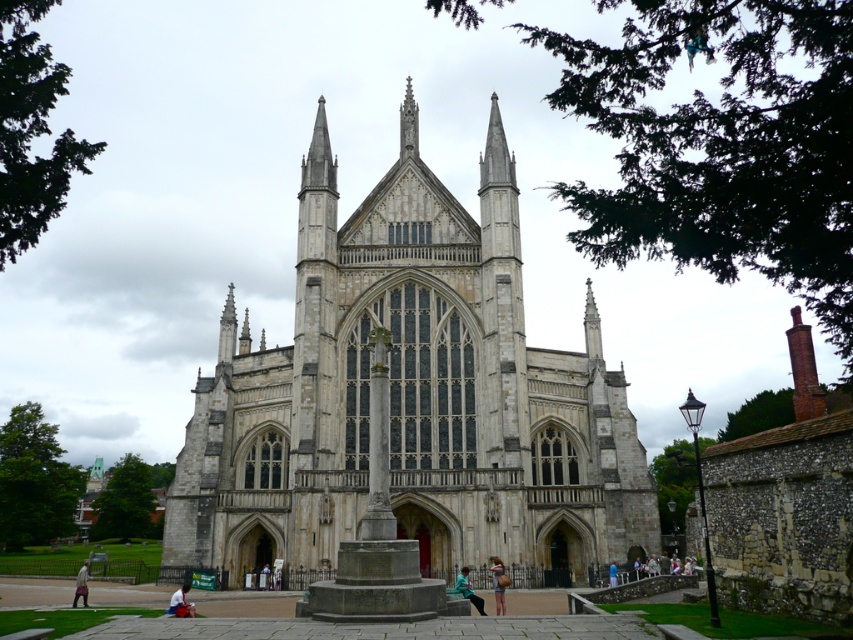
Question: Can you confirm if green leafy tree at upper center is thinner than green leafy tree at left?

Choices:
 (A) no
 (B) yes

Answer: (A)

Question: Does green leafy tree at lower left appear on the left side of blue fabric person at center?

Choices:
 (A) yes
 (B) no

Answer: (A)

Question: Estimate the real-world distances between objects in this image. Which object is farther from the green leafy tree at upper center?

Choices:
 (A) green fabric jacket at lower center
 (B) light blue jeans at center
 (C) light blue denim jeans at lower center

Answer: (B)

Question: Which point is closer to the camera?

Choices:
 (A) green leafy tree at upper left
 (B) light blue jeans at center
 (C) light blue denim jeans at lower center

Answer: (A)

Question: Is green leafy tree at upper center to the left of light brown leather jacket at lower left from the viewer's perspective?

Choices:
 (A) no
 (B) yes

Answer: (A)

Question: Among these objects, which one is nearest to the camera?

Choices:
 (A) light blue jeans at center
 (B) blue fabric person at center
 (C) green leafy tree at lower left

Answer: (A)